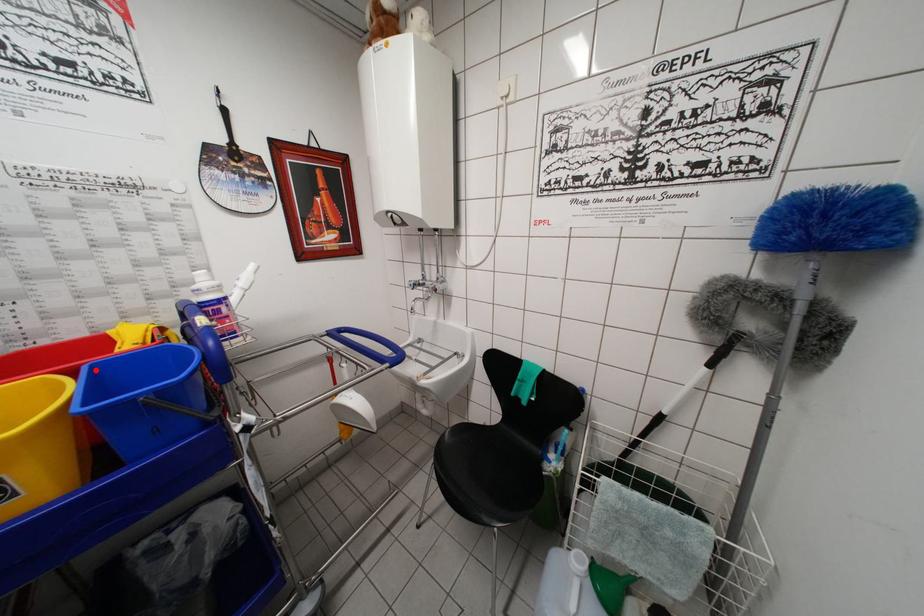
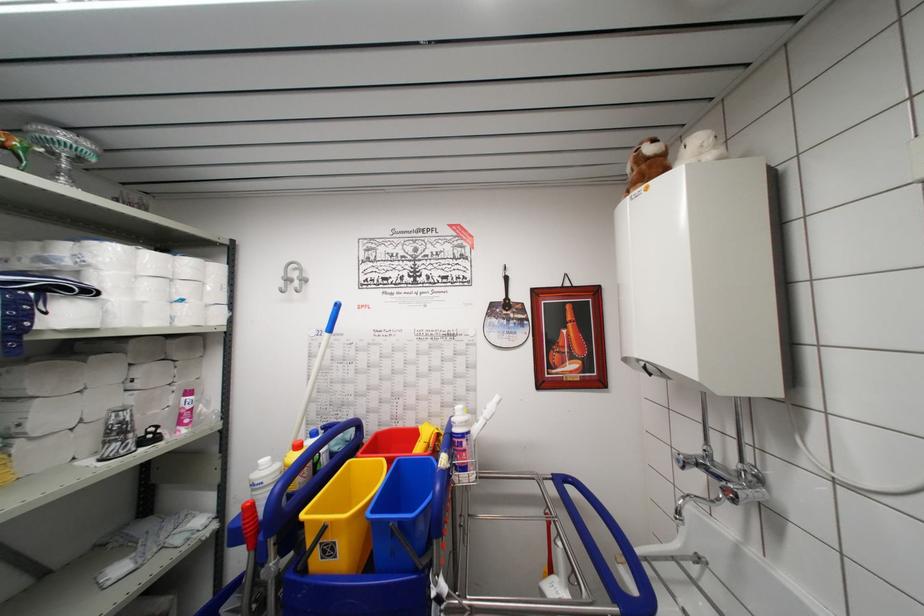
Locate, in the second image, the point that corresponds to the highlighted location in the first image.

(402, 466)